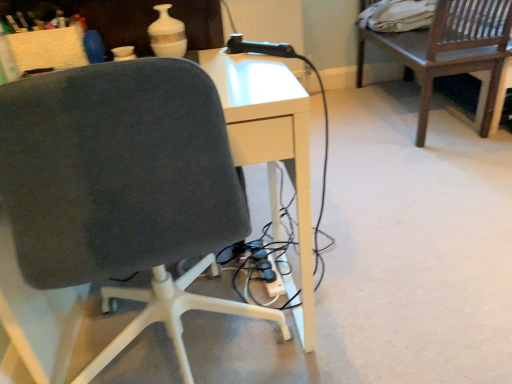
Question: Is dark wood chair at upper right inside the boundaries of dark gray fabric chair at center, or outside?

Choices:
 (A) outside
 (B) inside

Answer: (A)

Question: Considering the positions of point (485, 6) and point (81, 243), is point (485, 6) closer or farther from the camera than point (81, 243)?

Choices:
 (A) farther
 (B) closer

Answer: (A)

Question: Considering the positions of dark wood chair at upper right and dark gray fabric chair at center in the image, is dark wood chair at upper right bigger or smaller than dark gray fabric chair at center?

Choices:
 (A) big
 (B) small

Answer: (A)

Question: In terms of size, does dark gray fabric chair at center appear bigger or smaller than dark wood chair at upper right?

Choices:
 (A) big
 (B) small

Answer: (B)

Question: From their relative heights in the image, would you say dark gray fabric chair at center is taller or shorter than dark wood chair at upper right?

Choices:
 (A) short
 (B) tall

Answer: (B)

Question: From a real-world perspective, is dark gray fabric chair at center physically located above or below dark wood chair at upper right?

Choices:
 (A) above
 (B) below

Answer: (A)

Question: In the image, is dark gray fabric chair at center on the left side or the right side of dark wood chair at upper right?

Choices:
 (A) left
 (B) right

Answer: (A)